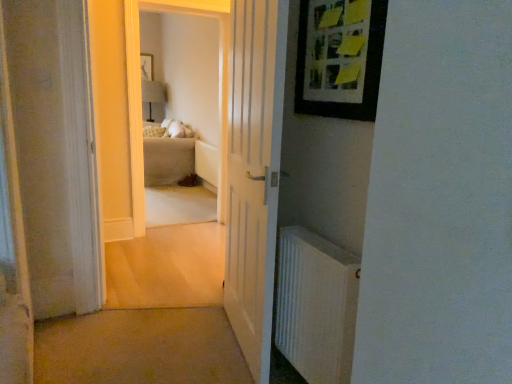
What do you see at coordinates (316, 305) in the screenshot?
I see `white plastic radiator at right` at bounding box center [316, 305].

Measure the distance between point (279, 331) and camera.

The depth of point (279, 331) is 2.09 meters.

Describe the element at coordinates (339, 59) in the screenshot. This screenshot has height=384, width=512. I see `wooden picture frame at upper right, which is the 2th picture frame from back to front` at that location.

This screenshot has height=384, width=512. What do you see at coordinates (140, 348) in the screenshot?
I see `carpet at center` at bounding box center [140, 348].

This screenshot has height=384, width=512. What are the coordinates of `carpet at center` in the screenshot? It's located at (140, 348).

Where is `white wooden door at center`? This screenshot has width=512, height=384. white wooden door at center is located at coordinates (254, 173).

Where is `picture frame located in front of the white wooden door at center`? This screenshot has height=384, width=512. picture frame located in front of the white wooden door at center is located at coordinates (339, 59).

Does wooden picture frame at upper right, which is the 2th picture frame from back to front, turn towards white wooden door at center?

No.

What's the angular difference between wooden picture frame at upper right, positioned as the second picture frame in left-to-right order, and white wooden door at center's facing directions?

The angular difference between wooden picture frame at upper right, positioned as the second picture frame in left-to-right order, and white wooden door at center is 9.74 degrees.

Between wooden picture frame at upper right, positioned as the second picture frame in left-to-right order, and white wooden door at center, which one is positioned in front?

Positioned in front is wooden picture frame at upper right, positioned as the second picture frame in left-to-right order.

Can you confirm if beige fabric couch at center is shorter than wooden picture frame at upper right, the 1th picture frame from the bottom?

Incorrect, the height of beige fabric couch at center does not fall short of that of wooden picture frame at upper right, the 1th picture frame from the bottom.

Is wooden picture frame at upper right, which appears as the first picture frame when viewed from the right, a part of beige fabric couch at center?

That's incorrect, wooden picture frame at upper right, which appears as the first picture frame when viewed from the right, is not inside beige fabric couch at center.

Could you measure the distance between beige fabric couch at center and wooden picture frame at upper right, the 2th picture frame from the top?

beige fabric couch at center and wooden picture frame at upper right, the 2th picture frame from the top, are 13.05 feet apart from each other.

From the image's perspective, between beige fabric couch at center and wooden picture frame at upper right, the 1th picture frame from the bottom, who is located below?

wooden picture frame at upper right, the 1th picture frame from the bottom, is shown below in the image.

Is beige fabric couch at center to the left of white wooden door at center from the viewer's perspective?

Indeed, beige fabric couch at center is positioned on the left side of white wooden door at center.

Can you confirm if beige fabric couch at center is smaller than white wooden door at center?

No, beige fabric couch at center is not smaller than white wooden door at center.

Who is taller, beige fabric couch at center or white wooden door at center?

white wooden door at center.

Considering the points (179, 166) and (239, 7), which point is in front, point (179, 166) or point (239, 7)?

The point (239, 7) is in front.

How much distance is there between white wooden door at center and carpet at center?

They are 27.34 inches apart.

Identify the location of path below the white wooden door at center (from the image's perspective). (140, 348).

Between white wooden door at center and carpet at center, which one has less height?

carpet at center is shorter.

Who is bigger, white wooden door at center or matte white lampshade at upper center?

white wooden door at center is bigger.

Is the depth of white wooden door at center greater than that of matte white lampshade at upper center?

No, it is in front of matte white lampshade at upper center.

Would you consider white wooden door at center to be distant from matte white lampshade at upper center?

white wooden door at center is positioned a significant distance from matte white lampshade at upper center.

Is white wooden door at center aimed at matte white lampshade at upper center?

No, white wooden door at center is not turned towards matte white lampshade at upper center.

Based on the photo, visually, is wooden picture frame at upper right, the 1th picture frame positioned from the front, positioned to the left or to the right of white plastic radiator at right?

From the image, it's evident that wooden picture frame at upper right, the 1th picture frame positioned from the front, is to the right of white plastic radiator at right.

Which object is wider, wooden picture frame at upper right, which appears as the first picture frame when viewed from the right, or white plastic radiator at right?

With larger width is white plastic radiator at right.

Is wooden picture frame at upper right, positioned as the second picture frame in left-to-right order, further to the viewer compared to white plastic radiator at right?

No, wooden picture frame at upper right, positioned as the second picture frame in left-to-right order, is closer to the viewer.

From their relative heights in the image, would you say wooden picture frame at upper right, the 1th picture frame positioned from the front, is taller or shorter than white plastic radiator at right?

wooden picture frame at upper right, the 1th picture frame positioned from the front, is shorter than white plastic radiator at right.

Can you tell me how much beige fabric couch at center and carpet at center differ in facing direction?

92.7 degrees.

From the image's perspective, which is below, beige fabric couch at center or carpet at center?

carpet at center is shown below in the image.

From a real-world perspective, which object rests below the other?

From a 3D spatial view, carpet at center is below.

The height and width of the screenshot is (384, 512). Find the location of `picture frame on the right of white wooden door at center`. picture frame on the right of white wooden door at center is located at coordinates (339, 59).

I want to click on couch located underneath the wooden picture frame at upper right, which appears as the first picture frame when viewed from the right (from a real-world perspective), so click(x=167, y=153).

Looking at the image, which one is located further to matte white lampshade at upper center, wooden picture frame at upper right, which appears as the first picture frame when viewed from the right, or carpet at center?

The object further to matte white lampshade at upper center is wooden picture frame at upper right, which appears as the first picture frame when viewed from the right.

Which object lies nearer to the anchor point wooden picture frame at upper right, the 1th picture frame from the bottom, white wooden door at center or matte white lampshade at upper center?

white wooden door at center is positioned closer to the anchor wooden picture frame at upper right, the 1th picture frame from the bottom.

Estimate the real-world distances between objects in this image. Which object is closer to matte white lampshade at upper center, white wooden door at center or carpet at center?

white wooden door at center lies closer to matte white lampshade at upper center than the other object.

Which object lies nearer to the anchor point carpet at center, matte black picture frame at upper center, positioned as the 2th picture frame in front-to-back order, or matte white lampshade at upper center?

matte white lampshade at upper center lies closer to carpet at center than the other object.

Looking at the image, which one is located closer to carpet at center, matte black picture frame at upper center, positioned as the 2th picture frame in front-to-back order, or white plastic radiator at right?

The object closer to carpet at center is white plastic radiator at right.

From the image, which object appears to be nearer to carpet at center, white plastic radiator at right or wooden picture frame at upper right, the 2th picture frame from the top?

white plastic radiator at right lies closer to carpet at center than the other object.

Estimate the real-world distances between objects in this image. Which object is further from matte black picture frame at upper center, positioned as the 2th picture frame in front-to-back order, wooden picture frame at upper right, which appears as the first picture frame when viewed from the right, or white wooden door at center?

Among the two, wooden picture frame at upper right, which appears as the first picture frame when viewed from the right, is located further to matte black picture frame at upper center, positioned as the 2th picture frame in front-to-back order.

Consider the image. Which object lies nearer to the anchor point matte white lampshade at upper center, wooden picture frame at upper right, which appears as the first picture frame when viewed from the right, or white plastic radiator at right?

wooden picture frame at upper right, which appears as the first picture frame when viewed from the right.

Locate an element on the screen. lamp between wooden picture frame at upper right, the 2th picture frame from the top, and matte black picture frame at upper center, positioned as the 2th picture frame in front-to-back order, in the front-back direction is located at coordinates (153, 94).

The image size is (512, 384). Find the location of `lamp between white wooden door at center and matte black picture frame at upper center, which appears as the 1th picture frame when viewed from the top, in the front-back direction`. lamp between white wooden door at center and matte black picture frame at upper center, which appears as the 1th picture frame when viewed from the top, in the front-back direction is located at coordinates (153, 94).

Find the location of a particular element. The image size is (512, 384). lamp positioned between beige fabric couch at center and matte black picture frame at upper center, positioned as the 2th picture frame in front-to-back order, from near to far is located at coordinates (153, 94).

Locate an element on the screen. couch positioned between carpet at center and matte black picture frame at upper center, which appears as the 1th picture frame when viewed from the back, from near to far is located at coordinates (167, 153).